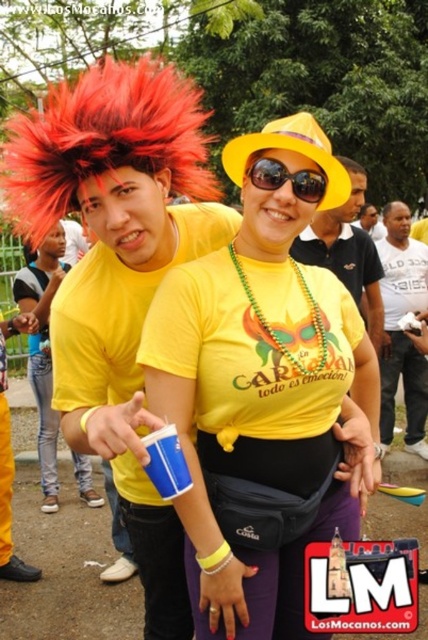
Question: Does yellow matte shirt at center appear on the right side of yellow matte cup at center?

Choices:
 (A) no
 (B) yes

Answer: (B)

Question: Which of these objects is positioned farthest from the yellow matte cup at center?

Choices:
 (A) sunglasses at center
 (B) white cotton shirt at center

Answer: (A)

Question: Among these points, which one is nearest to the camera?

Choices:
 (A) (398, 243)
 (B) (353, 264)
 (C) (296, 180)

Answer: (C)

Question: Can you confirm if white cotton shirt at center is positioned to the right of sunglasses at center?

Choices:
 (A) yes
 (B) no

Answer: (A)

Question: Which object is the farthest from the yellow matte shirt at center?

Choices:
 (A) yellow matte cup at center
 (B) white cotton shirt at center

Answer: (A)

Question: Can you confirm if yellow matte shirt at center is positioned to the left of matte yellow shirt at center?

Choices:
 (A) no
 (B) yes

Answer: (B)